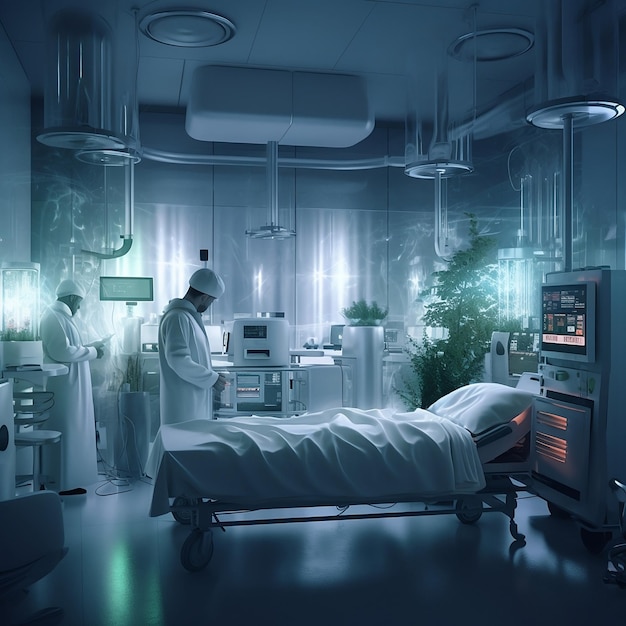
The width and height of the screenshot is (626, 626). Find the location of `screen`. screen is located at coordinates (561, 325).